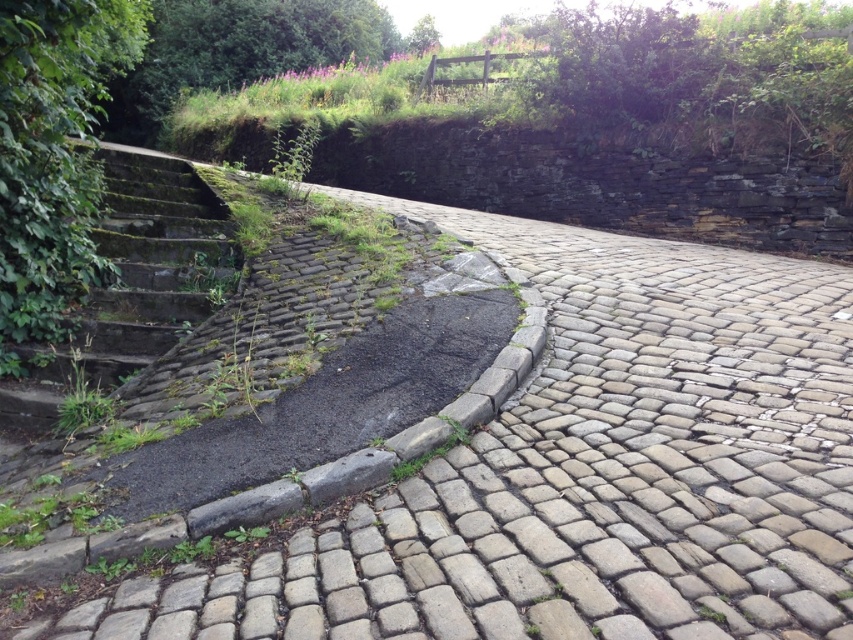
You are a delivery person carrying a package that requires a clear path of at least 6 feet to maneuver. You are standing at the gray cobblestone pavement at center and need to reach the mossy stone stairs at left. Can you navigate the space between them without needing to adjust your path?

The distance between the gray cobblestone pavement at center and the mossy stone stairs at left is 6.39 feet, which is more than the required 6 feet. Therefore, you can navigate the space without needing to adjust your path.

You are standing at the point with coordinates point (498, 381) and want to walk towards the point (171, 234). Based on the scene description, will you be moving closer to or farther from the camera as you walk?

Since point (498, 381) is closer to the camera than point (171, 234), walking from point (498, 381) towards point (171, 234) means you will be moving farther from the camera.